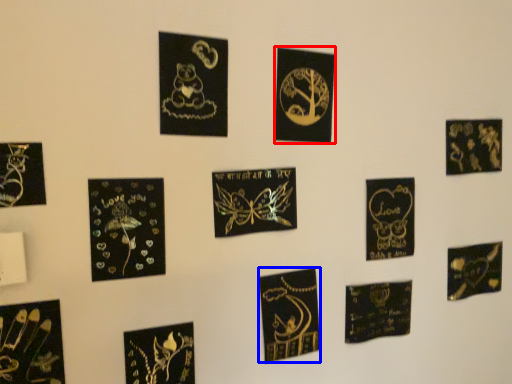
Question: Among these objects, which one is nearest to the camera, picture frame (highlighted by a red box) or embroidery (highlighted by a blue box)?

Choices:
 (A) picture frame
 (B) embroidery

Answer: (A)